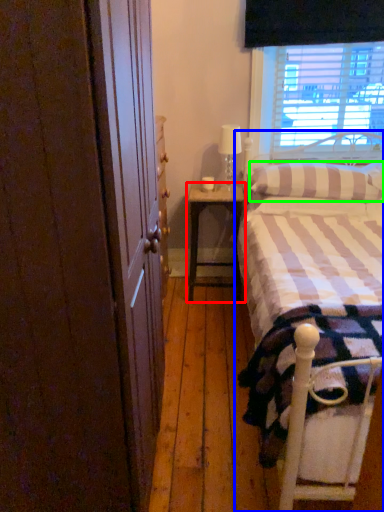
Question: Which object is positioned farthest from nightstand (highlighted by a red box)? Select from bed (highlighted by a blue box) and pillow (highlighted by a green box).

Choices:
 (A) bed
 (B) pillow

Answer: (A)